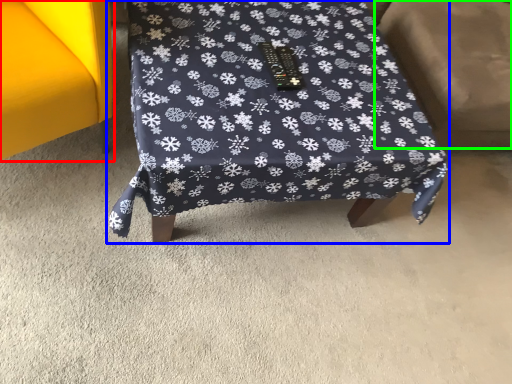
Question: Considering the real-world distances, which object is farthest from furniture (highlighted by a red box)? furniture (highlighted by a blue box) or swivel chair (highlighted by a green box)?

Choices:
 (A) furniture
 (B) swivel chair

Answer: (B)